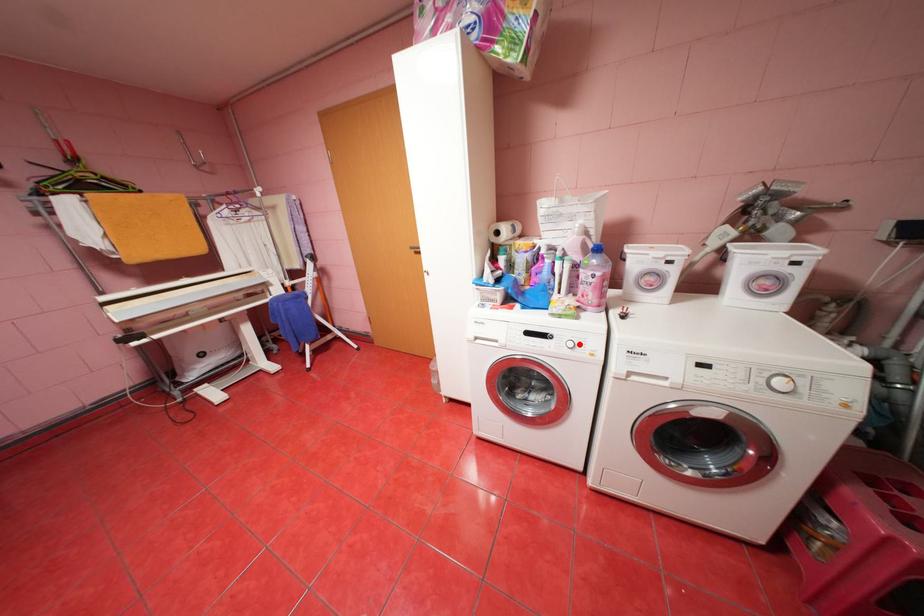
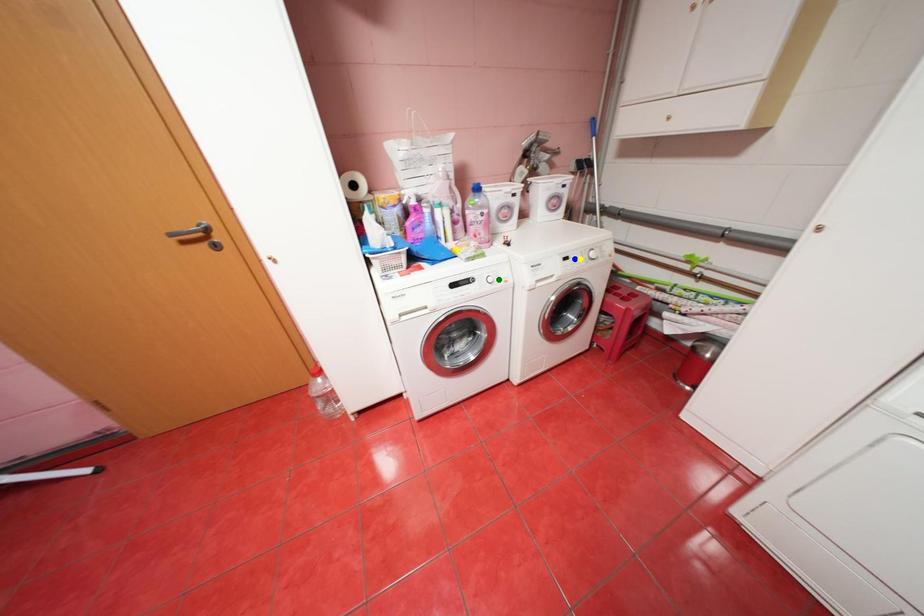
Question: I am providing you with two images of the same scene from different viewpoints. A red point is marked on the first image. You are given multiple points on the second image. Which mark in image 2 goes with the point in image 1?

Choices:
 (A) green point
 (B) blue point
 (C) yellow point

Answer: (A)